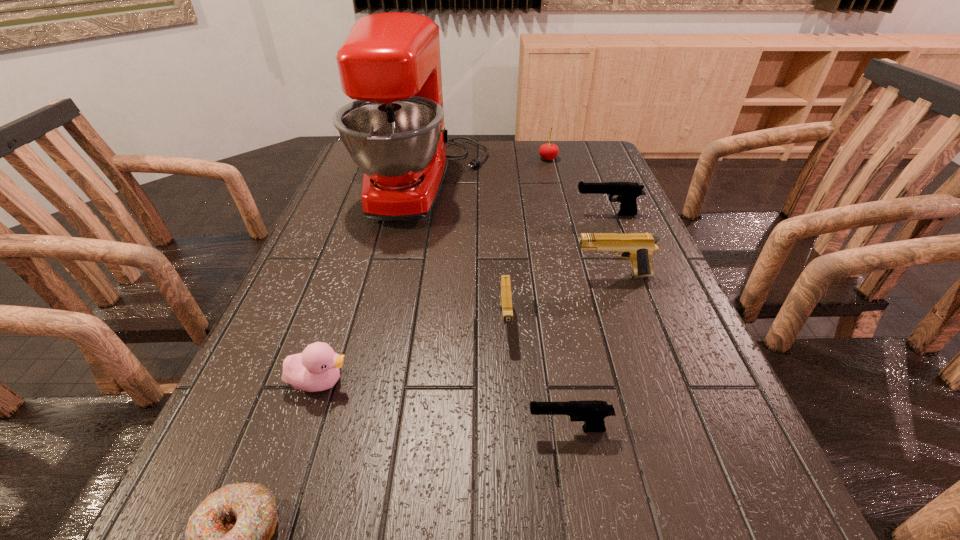
Where is `the leftmost pistol`? The width and height of the screenshot is (960, 540). the leftmost pistol is located at coordinates (505, 294).

This screenshot has height=540, width=960. What are the coordinates of `the nearest pistol` in the screenshot? It's located at (593, 413).

I want to click on the seventh farthest object, so point(593,413).

You are a GUI agent. You are given a task and a screenshot of the screen. Output one action in this format:
    pyautogui.click(x=<x>, y=<y>)
    Task: Click on the vacant region located on the front-facing side of the tallest object
    The width and height of the screenshot is (960, 540).
    Given the screenshot: What is the action you would take?
    pyautogui.click(x=581, y=183)

Where is `vacant area situated 0.080m on the right of the red cherry`? vacant area situated 0.080m on the right of the red cherry is located at coordinates (582, 159).

Locate an element on the screen. The image size is (960, 540). vacant space located 0.150m at the barrel of the bigger tan pistol is located at coordinates (508, 275).

Find the location of a particular element. The height and width of the screenshot is (540, 960). vacant region located 0.400m at the barrel of the bigger tan pistol is located at coordinates (399, 275).

Find the location of a particular element. This screenshot has height=540, width=960. vacant area situated 0.210m at the barrel of the bigger tan pistol is located at coordinates (482, 275).

Identify the location of free spot located 0.070m on the front-facing side of the farther black pistol. (548, 214).

The width and height of the screenshot is (960, 540). In order to click on vacant space located 0.080m on the front-facing side of the farther black pistol in this screenshot , I will do point(545,214).